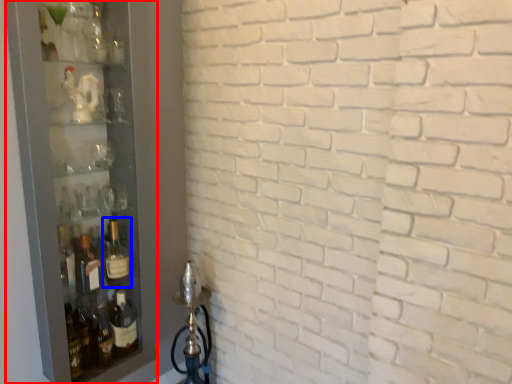
Question: Which of the following is the closest to the observer, glass door (highlighted by a red box) or bottle (highlighted by a blue box)?

Choices:
 (A) glass door
 (B) bottle

Answer: (A)